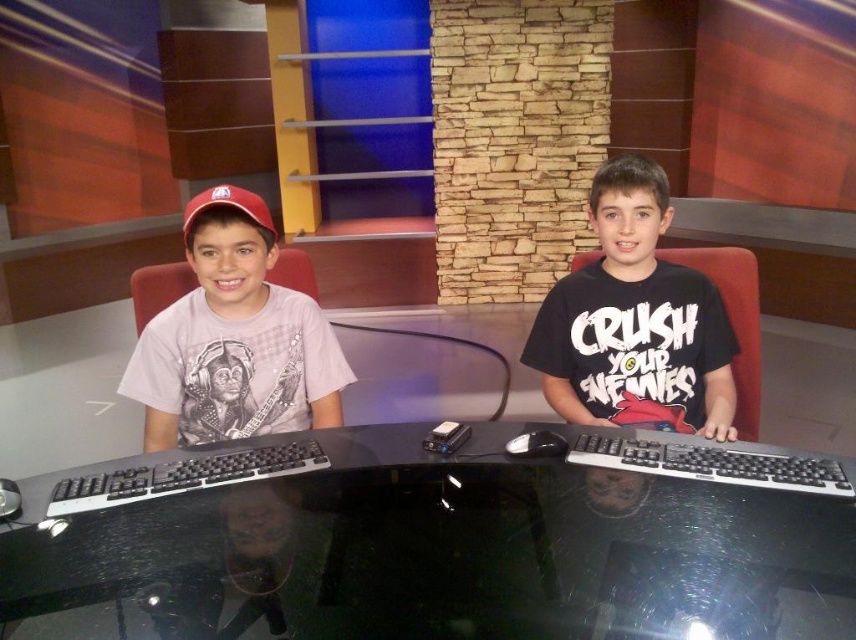
Describe the element at coordinates (712, 461) in the screenshot. I see `black plastic keyboard at center` at that location.

Between black plastic keyboard at center and black plastic keyboard at left, which one appears on the right side from the viewer's perspective?

black plastic keyboard at center is more to the right.

Is point (736, 460) positioned in front of point (318, 445)?

Yes, point (736, 460) is in front of point (318, 445).

Locate an element on the screen. This screenshot has height=640, width=856. black plastic keyboard at center is located at coordinates (712, 461).

Which is more to the left, black glossy computer desk at center or black matte t-shirt at center?

black glossy computer desk at center

Is point (745, 499) behind point (637, 180)?

No, it is not.

You are a GUI agent. You are given a task and a screenshot of the screen. Output one action in this format:
    pyautogui.click(x=<x>, y=<y>)
    Task: Click on the black glossy computer desk at center
    The width and height of the screenshot is (856, 640).
    Given the screenshot: What is the action you would take?
    pyautogui.click(x=431, y=547)

Is point (238, 294) farther from viewer compared to point (215, 195)?

Yes, it is behind point (215, 195).

Where is `matte gray t-shirt at left`? matte gray t-shirt at left is located at coordinates (235, 339).

Identify the location of matte gray t-shirt at left. (235, 339).